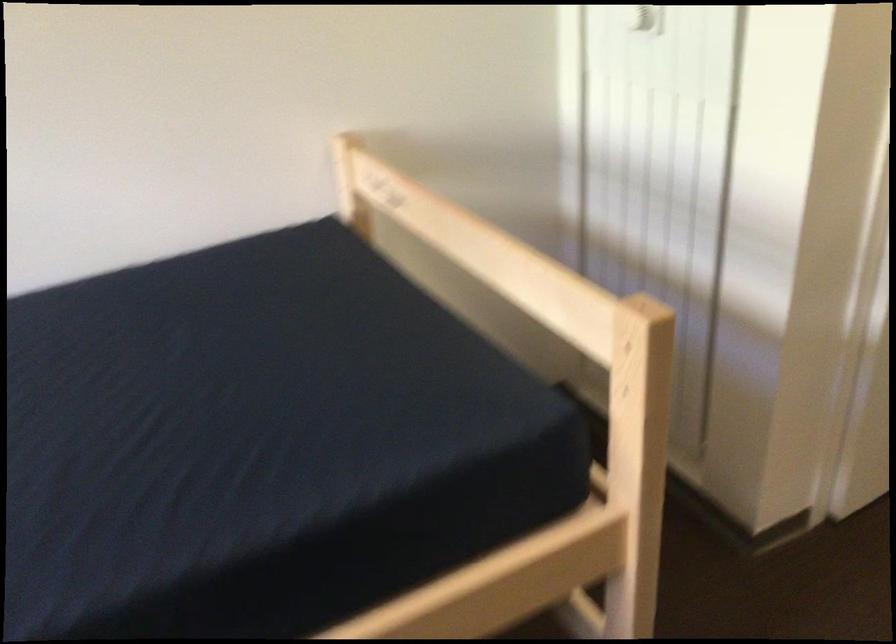
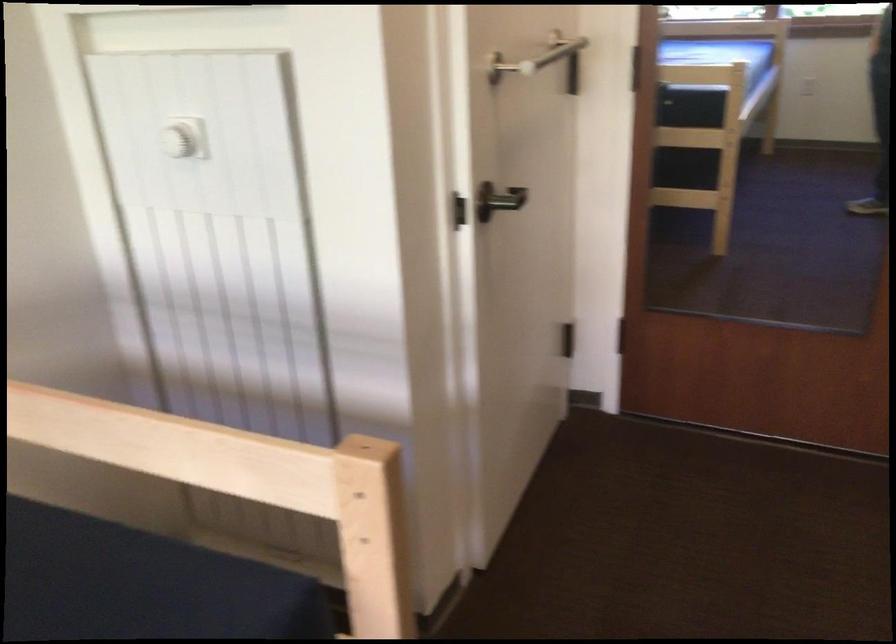
Question: The images are taken continuously from a first-person perspective. In which direction is your viewpoint rotating?

Choices:
 (A) Left
 (B) Right
 (C) Up
 (D) Down

Answer: (B)